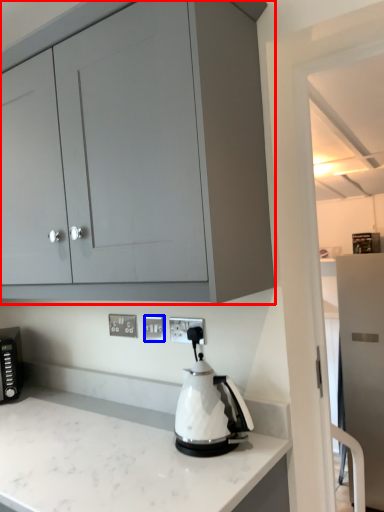
Question: Which of the following is the farthest to the observer, cabinetry (highlighted by a red box) or electric outlet (highlighted by a blue box)?

Choices:
 (A) cabinetry
 (B) electric outlet

Answer: (B)